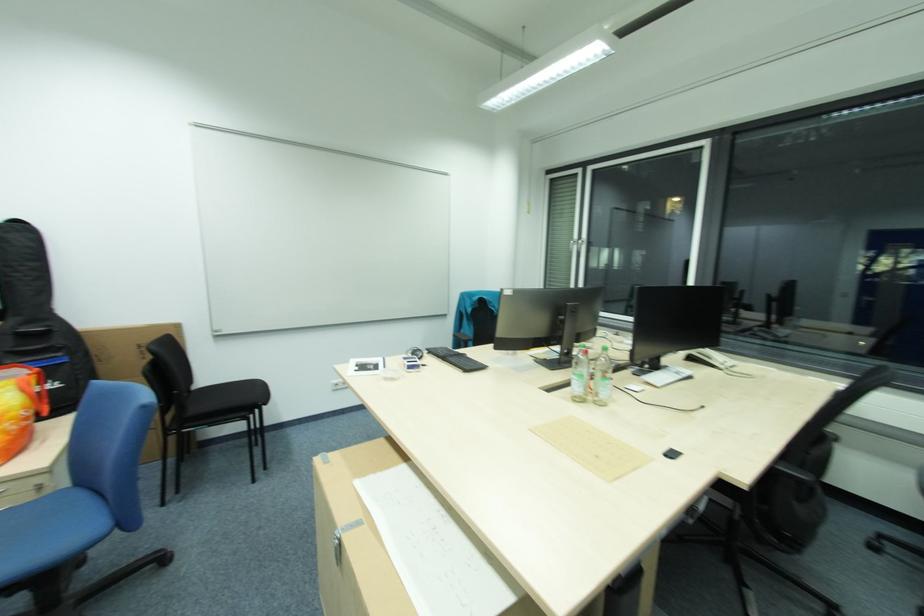
Identify the location of guitar case handle. This screenshot has height=616, width=924. (30, 333).